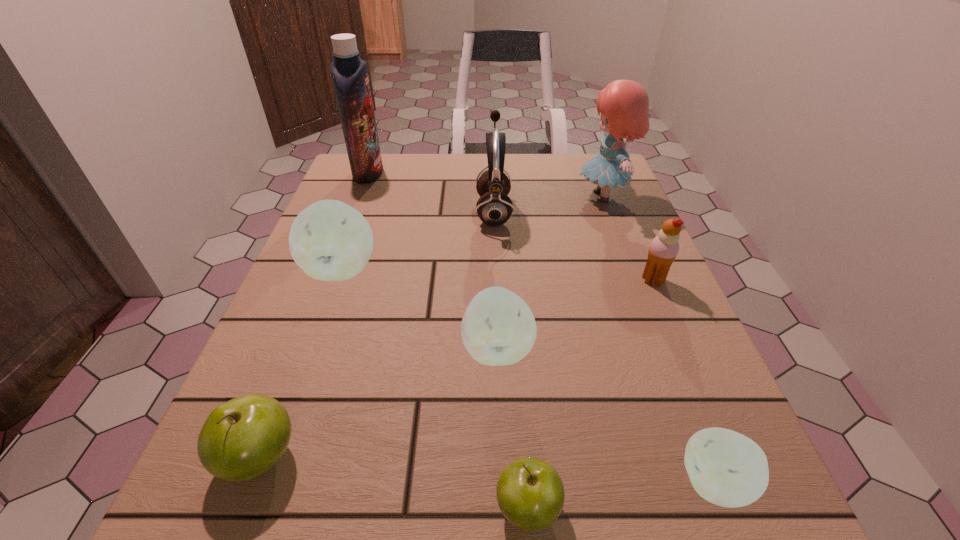
Find the location of a particular element. earphone present at the far edge is located at coordinates (494, 207).

Find the location of `shampoo at the left edge`. shampoo at the left edge is located at coordinates (349, 72).

What are the coordinates of `doll that is at the right edge` in the screenshot? It's located at (624, 104).

The height and width of the screenshot is (540, 960). I want to click on icecream present at the right edge, so [664, 248].

This screenshot has width=960, height=540. What are the coordinates of `apple at the right edge` in the screenshot? It's located at (726, 468).

This screenshot has height=540, width=960. What are the coordinates of `object located at the far left corner` in the screenshot? It's located at (349, 72).

Where is `object located in the near left corner section of the desktop`? object located in the near left corner section of the desktop is located at coordinates (241, 439).

Where is `object that is at the far right corner`? The width and height of the screenshot is (960, 540). object that is at the far right corner is located at coordinates (624, 104).

This screenshot has height=540, width=960. I want to click on object that is positioned at the near right corner, so click(x=726, y=468).

Identify the location of vacant region at the far edge of the desktop. The image size is (960, 540). (439, 165).